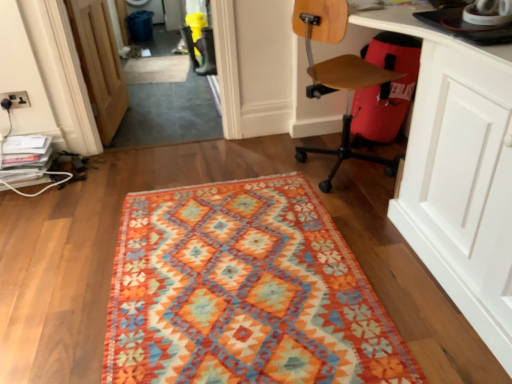
At what (x,y) coordinates should I click in order to perform the action: click on free point above beige carpet at center (from a real-world perspective). Please return your answer as a coordinate pair (x, y). Image resolution: width=512 pixels, height=384 pixels. Looking at the image, I should click on (154, 62).